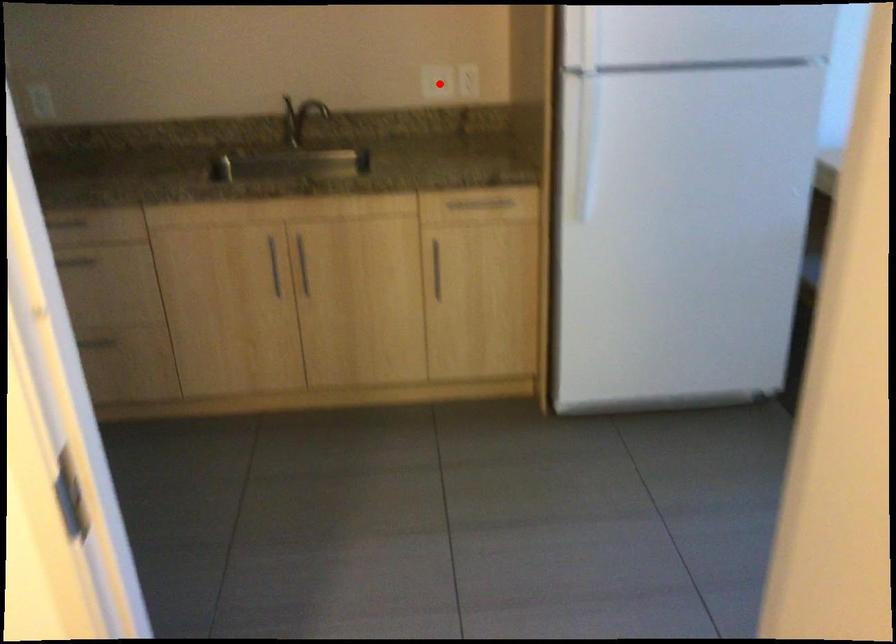
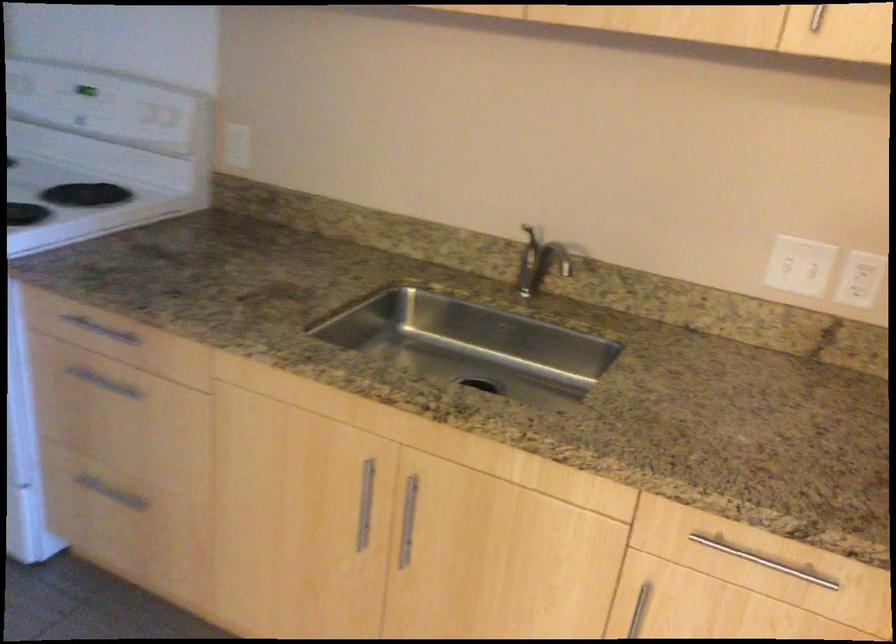
Find the pixel in the second image that matches the highlighted location in the first image.

(798, 266)